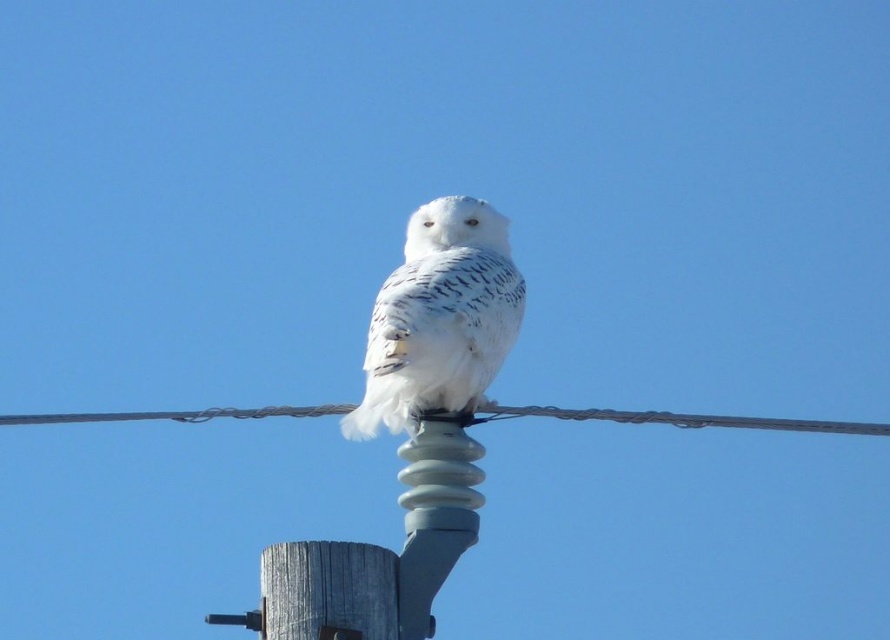
You are a photographer standing at a certain distance from the gray rubber insulator at center. You want to take a photo of the snowy owl perched on it. Considering the distance between you and the insulator, would you need a telephoto lens to capture the owl clearly?

The distance between the gray rubber insulator at center and the camera is 21.72 feet, so yes, you would need a telephoto lens to capture the snowy owl perched on the gray rubber insulator at center clearly from that distance.

You are a photographer trying to capture the snowy owl on the utility pole. You notice two points marked in the scene. The first point is at coordinates point (x=429, y=634) and the second point is at point (x=812, y=422). Which point is closer to your camera lens?

Point (x=429, y=634) is closer to the camera than point (x=812, y=422).